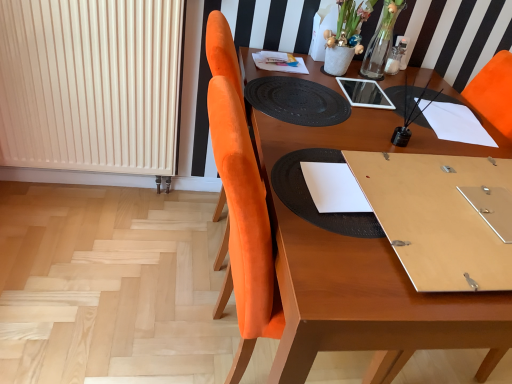
Where is `free location in front of black textured placemat at center`? Image resolution: width=512 pixels, height=384 pixels. free location in front of black textured placemat at center is located at coordinates (368, 271).